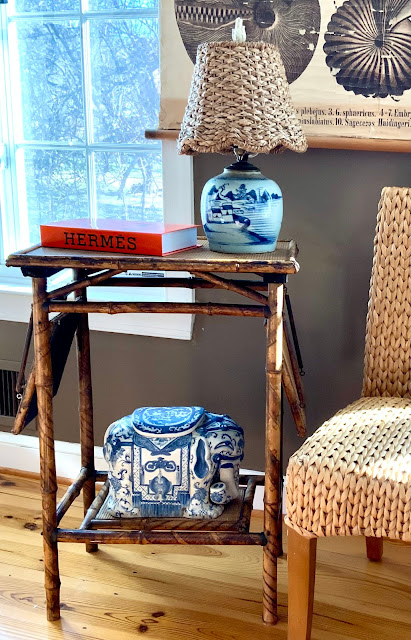
Find the location of a particular element. floor is located at coordinates (164, 587).